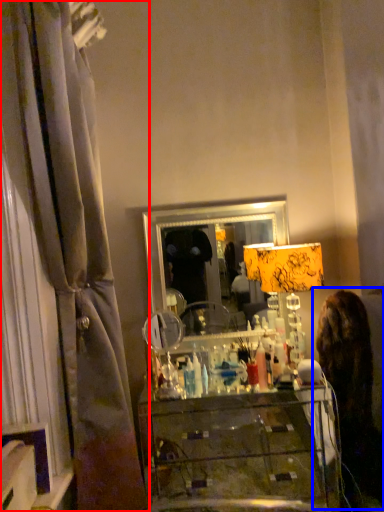
Question: Which point is closer to the camera, curtain (highlighted by a red box) or woman (highlighted by a blue box)?

Choices:
 (A) curtain
 (B) woman

Answer: (A)